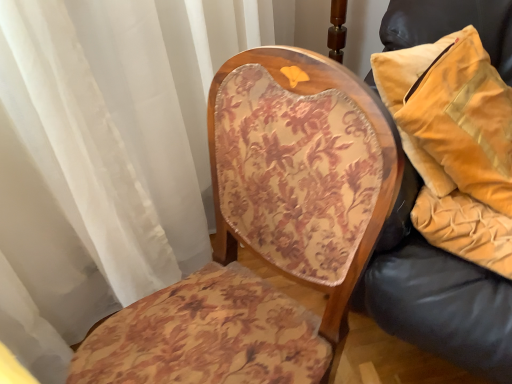
What is the approximate width of floral-patterned fabric chair at center?

floral-patterned fabric chair at center is 20.34 inches wide.

This screenshot has width=512, height=384. In order to click on floral-patterned fabric chair at center in this screenshot , I will do `click(266, 234)`.

What do you see at coordinates (452, 116) in the screenshot? I see `velvet/yellow pillow at right` at bounding box center [452, 116].

Where is `floral-patterned fabric chair at center`? The height and width of the screenshot is (384, 512). floral-patterned fabric chair at center is located at coordinates (266, 234).

Can you confirm if velvet/yellow pillow at right is thinner than floral-patterned fabric chair at center?

Yes, velvet/yellow pillow at right is thinner than floral-patterned fabric chair at center.

Is floral-patterned fabric chair at center at the back of velvet/yellow pillow at right?

No, velvet/yellow pillow at right is not facing away from floral-patterned fabric chair at center.

From a real-world perspective, which is physically above, velvet/yellow pillow at right or floral-patterned fabric chair at center?

In real-world perspective, velvet/yellow pillow at right is above.

Considering the sizes of objects velvet/yellow pillow at right and velvet yellow pillow at right in the image provided, who is wider, velvet/yellow pillow at right or velvet yellow pillow at right?

Wider between the two is velvet/yellow pillow at right.

From the image's perspective, does velvet/yellow pillow at right appear lower than velvet yellow pillow at right?

No.

From a real-world perspective, is velvet/yellow pillow at right under velvet yellow pillow at right?

Yes, from a real-world perspective, velvet/yellow pillow at right is under velvet yellow pillow at right.

From the image's perspective, is velvet yellow pillow at right over velvet/yellow pillow at right?

No, from the image's perspective, velvet yellow pillow at right is not above velvet/yellow pillow at right.

Does velvet yellow pillow at right contain velvet/yellow pillow at right?

Yes, velvet/yellow pillow at right is a part of velvet yellow pillow at right.

This screenshot has width=512, height=384. I want to click on furniture positioned vertically above the velvet/yellow pillow at right (from a real-world perspective), so click(441, 305).

Is point (510, 44) farther from camera compared to point (444, 59)?

Yes, it is behind point (444, 59).

Does velvet yellow pillow at right lie in front of floral-patterned fabric chair at center?

That is False.

In the scene shown: Would you say velvet yellow pillow at right is outside floral-patterned fabric chair at center?

Yes.

Would you say velvet yellow pillow at right is to the left or to the right of floral-patterned fabric chair at center in the picture?

In the image, velvet yellow pillow at right appears on the right side of floral-patterned fabric chair at center.

How many degrees apart are the facing directions of velvet yellow pillow at right and floral-patterned fabric chair at center?

69.2 degrees.

In the scene shown: How far apart are floral-patterned fabric chair at center and velvet/yellow pillow at right?

floral-patterned fabric chair at center and velvet/yellow pillow at right are 48.43 centimeters apart.

From a real-world perspective, which object rests below the other?

In real-world perspective, floral-patterned fabric chair at center is lower.

From the image's perspective, is floral-patterned fabric chair at center located beneath velvet/yellow pillow at right?

Yes, from the image's perspective, floral-patterned fabric chair at center is beneath velvet/yellow pillow at right.

Is floral-patterned fabric chair at center facing away from velvet/yellow pillow at right?

Yes, velvet/yellow pillow at right is at the back of floral-patterned fabric chair at center.

Considering their positions, is floral-patterned fabric chair at center located in front of or behind velvet yellow pillow at right?

In the image, floral-patterned fabric chair at center appears in front of velvet yellow pillow at right.

Could velvet yellow pillow at right be considered to be inside floral-patterned fabric chair at center?

No, velvet yellow pillow at right is not surrounded by floral-patterned fabric chair at center.

From the image's perspective, which one is positioned higher, floral-patterned fabric chair at center or velvet yellow pillow at right?

velvet yellow pillow at right, from the image's perspective.

Considering the sizes of objects floral-patterned fabric chair at center and velvet yellow pillow at right in the image provided, who is bigger, floral-patterned fabric chair at center or velvet yellow pillow at right?

With larger size is floral-patterned fabric chair at center.

The height and width of the screenshot is (384, 512). Find the location of `chair to the left of velvet/yellow pillow at right`. chair to the left of velvet/yellow pillow at right is located at coordinates (266, 234).

Where is `furniture that is below the velvet/yellow pillow at right (from the image's perspective)`? This screenshot has width=512, height=384. furniture that is below the velvet/yellow pillow at right (from the image's perspective) is located at coordinates (441, 305).

When comparing their distances from floral-patterned fabric chair at center, does velvet/yellow pillow at right or velvet yellow pillow at right seem further?

velvet/yellow pillow at right is positioned further to the anchor floral-patterned fabric chair at center.

Considering their positions, is floral-patterned fabric chair at center positioned closer to velvet yellow pillow at right than velvet/yellow pillow at right?

velvet/yellow pillow at right is closer to velvet yellow pillow at right.

Considering their positions, is velvet/yellow pillow at right positioned further to velvet yellow pillow at right than floral-patterned fabric chair at center?

floral-patterned fabric chair at center is positioned further to the anchor velvet yellow pillow at right.

When comparing their distances from velvet/yellow pillow at right, does floral-patterned fabric chair at center or velvet yellow pillow at right seem closer?

The object closer to velvet/yellow pillow at right is velvet yellow pillow at right.

Based on their spatial positions, is velvet yellow pillow at right or floral-patterned fabric chair at center closer to velvet/yellow pillow at right?

velvet yellow pillow at right is closer to velvet/yellow pillow at right.

When comparing their distances from floral-patterned fabric chair at center, does velvet yellow pillow at right or velvet/yellow pillow at right seem closer?

velvet yellow pillow at right lies closer to floral-patterned fabric chair at center than the other object.

I want to click on pillow located between floral-patterned fabric chair at center and velvet yellow pillow at right in the left-right direction, so click(x=452, y=116).